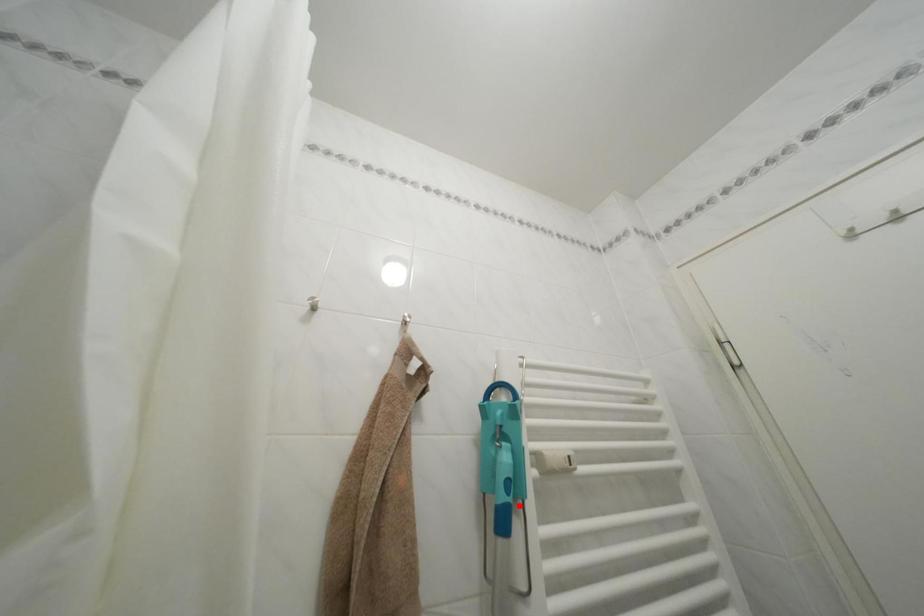
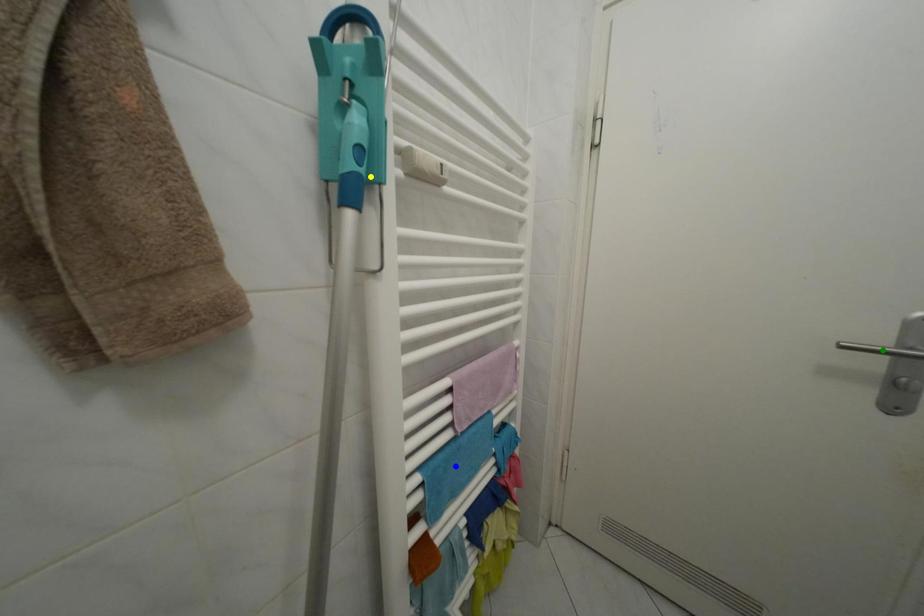
Question: I am providing you with two images of the same scene from different viewpoints. A red point is marked on the first image. You are given multiple points on the second image. Can you choose the point in image 2 that corresponds to the point in image 1?

Choices:
 (A) yellow point
 (B) green point
 (C) blue point

Answer: (A)